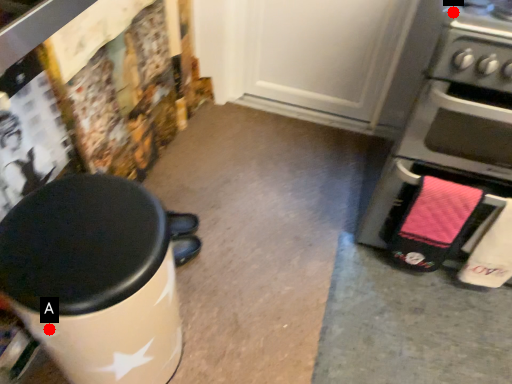
Question: Two points are circled on the image, labeled by A and B beside each circle. Which point is closer to the camera?

Choices:
 (A) A is closer
 (B) B is closer

Answer: (A)